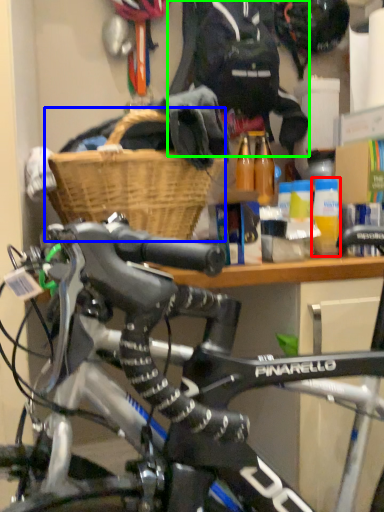
Question: Which is farther away from bottle (highlighted by a red box)? basket (highlighted by a blue box) or clothing (highlighted by a green box)?

Choices:
 (A) basket
 (B) clothing

Answer: (B)